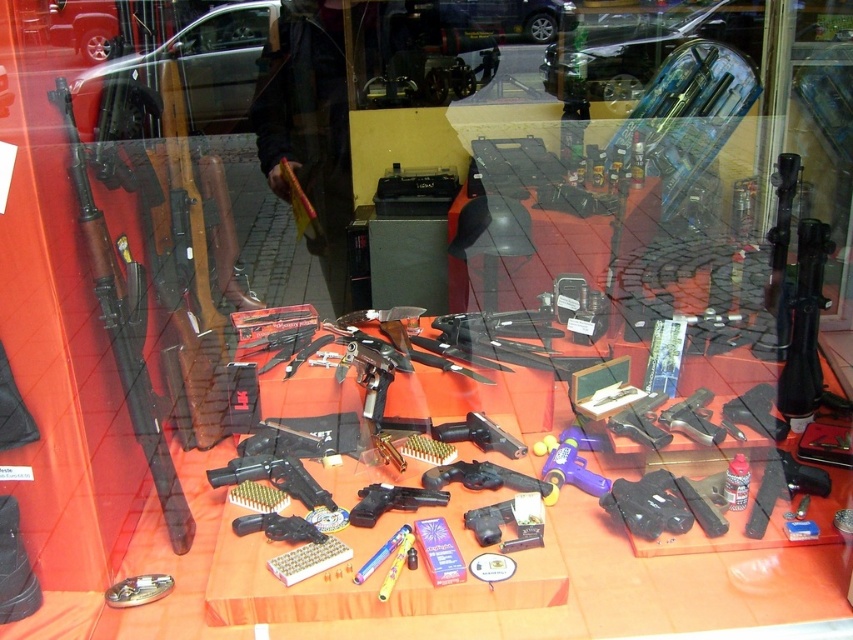
Question: Which point is closer to the camera?

Choices:
 (A) matte black handgun at center
 (B) wooden rifle at left
 (C) polished black handgun at center

Answer: (B)

Question: Is the position of polished black handgun at center more distant than that of matte black handgun at center?

Choices:
 (A) no
 (B) yes

Answer: (B)

Question: Which object is the farthest from the wooden rifle at left?

Choices:
 (A) matte black handgun at center
 (B) polished black handgun at center

Answer: (A)

Question: Is polished black handgun at center above matte black handgun at center?

Choices:
 (A) no
 (B) yes

Answer: (B)

Question: Does wooden rifle at left appear on the right side of matte black handgun at center?

Choices:
 (A) no
 (B) yes

Answer: (A)

Question: Which point is farther to the camera?

Choices:
 (A) (236, 472)
 (B) (160, 481)
 (C) (387, 488)

Answer: (A)